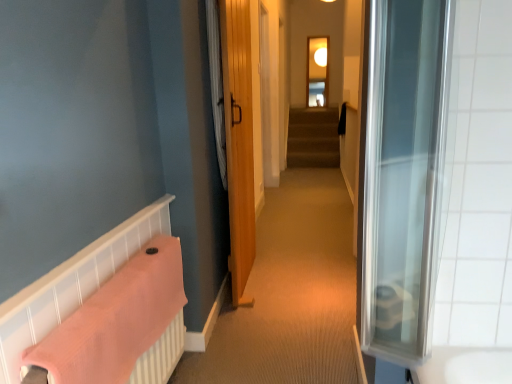
The image size is (512, 384). What do you see at coordinates (118, 319) in the screenshot?
I see `pink fabric towel at lower left` at bounding box center [118, 319].

This screenshot has width=512, height=384. Describe the element at coordinates (317, 71) in the screenshot. I see `transparent glass window at upper center` at that location.

Find the location of `wooden door at center`. wooden door at center is located at coordinates (239, 141).

You are a GUI agent. You are given a task and a screenshot of the screen. Output one action in this format:
    pyautogui.click(x=<x>, y=<y>)
    Task: Click on the pink fabric towel at lower left
    
    Given the screenshot: What is the action you would take?
    pyautogui.click(x=118, y=319)

From a real-world perspective, does wooden door at center sit lower than pink fabric towel at lower left?

No, from a real-world perspective, wooden door at center is not under pink fabric towel at lower left.

Does point (228, 111) lie behind point (112, 278)?

Yes, point (228, 111) is farther from viewer.

Does wooden door at center have a greater width compared to pink fabric towel at lower left?

No, wooden door at center is not wider than pink fabric towel at lower left.

How different are the orientations of wooden door at center and pink fabric towel at lower left in degrees?

0.739 degrees.

Is transparent glass window at upper center aimed at pink fabric towel at lower left?

Yes, transparent glass window at upper center is facing pink fabric towel at lower left.

Does transparent glass window at upper center have a smaller size compared to pink fabric towel at lower left?

Indeed, transparent glass window at upper center has a smaller size compared to pink fabric towel at lower left.

From a real-world perspective, is transparent glass window at upper center on top of pink fabric towel at lower left?

Indeed, from a real-world perspective, transparent glass window at upper center stands above pink fabric towel at lower left.

The width and height of the screenshot is (512, 384). I want to click on bath towel that is under the transparent glass window at upper center (from a real-world perspective), so click(x=118, y=319).

Does pink fabric towel at lower left have a greater width compared to white fabric shower curtain at center?

Yes, pink fabric towel at lower left is wider than white fabric shower curtain at center.

Is pink fabric towel at lower left turned away from white fabric shower curtain at center?

No, white fabric shower curtain at center is not at the back of pink fabric towel at lower left.

From the image's perspective, between pink fabric towel at lower left and white fabric shower curtain at center, who is located below?

pink fabric towel at lower left appears lower in the image.

Is pink fabric towel at lower left bigger or smaller than white fabric shower curtain at center?

Clearly, pink fabric towel at lower left is larger in size than white fabric shower curtain at center.

I want to click on window located above the white fabric shower curtain at center (from a real-world perspective), so click(x=317, y=71).

From a real-world perspective, does white fabric shower curtain at center stand above transparent glass window at upper center?

No.

Between white fabric shower curtain at center and transparent glass window at upper center, which one has larger width?

With larger width is white fabric shower curtain at center.

From the image's perspective, is white fabric shower curtain at center beneath transparent glass window at upper center?

Indeed, from the image's perspective, white fabric shower curtain at center is shown beneath transparent glass window at upper center.

Which is in front, pink fabric towel at lower left or wooden door at center?

pink fabric towel at lower left is closer to the camera.

Which is in front, point (169, 271) or point (240, 279)?

Point (169, 271)

Is pink fabric towel at lower left located outside wooden door at center?

pink fabric towel at lower left is positioned outside wooden door at center.

What's the angular difference between pink fabric towel at lower left and wooden door at center's facing directions?

0.739 degrees separate the facing orientations of pink fabric towel at lower left and wooden door at center.

Is white fabric shower curtain at center oriented away from wooden door at center?

No.

From the image's perspective, is white fabric shower curtain at center below wooden door at center?

Incorrect, from the image's perspective, white fabric shower curtain at center is higher than wooden door at center.

Is white fabric shower curtain at center located outside wooden door at center?

No, white fabric shower curtain at center is not outside of wooden door at center.

Does white fabric shower curtain at center have a lesser width compared to wooden door at center?

Yes, white fabric shower curtain at center is thinner than wooden door at center.

Which is closer, [317,92] or [230,101]?

Positioned in front is point [230,101].

Can you tell me how much transparent glass window at upper center and wooden door at center differ in facing direction?

The facing directions of transparent glass window at upper center and wooden door at center are 90.9 degrees apart.

Where is `window on the right of wooden door at center`? The image size is (512, 384). window on the right of wooden door at center is located at coordinates (317, 71).

Which of these two, transparent glass window at upper center or wooden door at center, stands taller?

With more height is wooden door at center.

This screenshot has height=384, width=512. I want to click on door that appears behind the pink fabric towel at lower left, so click(239, 141).

Where is `window above the pink fabric towel at lower left (from the image's perspective)`? The height and width of the screenshot is (384, 512). window above the pink fabric towel at lower left (from the image's perspective) is located at coordinates pyautogui.click(x=317, y=71).

When comparing their distances from pink fabric towel at lower left, does transparent glass window at upper center or white fabric shower curtain at center seem closer?

white fabric shower curtain at center.

Considering their positions, is wooden door at center positioned closer to pink fabric towel at lower left than transparent glass window at upper center?

wooden door at center is closer to pink fabric towel at lower left.

Consider the image. Based on their spatial positions, is transparent glass window at upper center or white fabric shower curtain at center further from wooden door at center?

Among the two, transparent glass window at upper center is located further to wooden door at center.

Which object lies further to the anchor point white fabric shower curtain at center, pink fabric towel at lower left or wooden door at center?

The object further to white fabric shower curtain at center is pink fabric towel at lower left.

From the image, which object appears to be nearer to white fabric shower curtain at center, pink fabric towel at lower left or transparent glass window at upper center?

pink fabric towel at lower left lies closer to white fabric shower curtain at center than the other object.

Estimate the real-world distances between objects in this image. Which object is further from wooden door at center, pink fabric towel at lower left or white fabric shower curtain at center?

Based on the image, pink fabric towel at lower left appears to be further to wooden door at center.

From the image, which object appears to be nearer to transparent glass window at upper center, wooden door at center or pink fabric towel at lower left?

wooden door at center is positioned closer to the anchor transparent glass window at upper center.

Based on the photo, looking at the image, which one is located further to wooden door at center, pink fabric towel at lower left or transparent glass window at upper center?

Based on the image, transparent glass window at upper center appears to be further to wooden door at center.

Image resolution: width=512 pixels, height=384 pixels. I want to click on shower curtain positioned between wooden door at center and transparent glass window at upper center from near to far, so click(217, 85).

Find the location of `shower curtain located between pink fabric towel at lower left and transparent glass window at upper center in the depth direction`. shower curtain located between pink fabric towel at lower left and transparent glass window at upper center in the depth direction is located at coordinates (217, 85).

Where is `door between pink fabric towel at lower left and white fabric shower curtain at center along the z-axis`? The height and width of the screenshot is (384, 512). door between pink fabric towel at lower left and white fabric shower curtain at center along the z-axis is located at coordinates (239, 141).

The height and width of the screenshot is (384, 512). I want to click on door between pink fabric towel at lower left and transparent glass window at upper center from front to back, so click(239, 141).